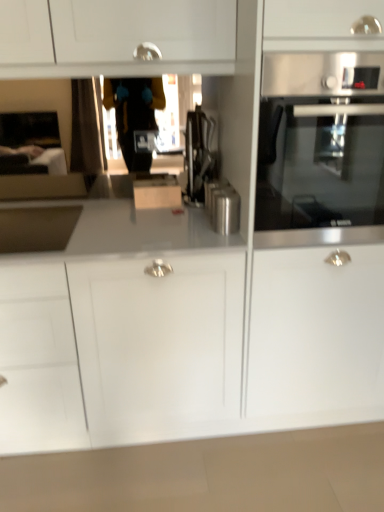
Question: From a real-world perspective, does satin nickel sink at left stand above satin metallic canister at center?

Choices:
 (A) yes
 (B) no

Answer: (B)

Question: Is satin nickel sink at left oriented away from satin metallic canister at center?

Choices:
 (A) no
 (B) yes

Answer: (A)

Question: From the image's perspective, does satin nickel sink at left appear higher than satin metallic canister at center?

Choices:
 (A) no
 (B) yes

Answer: (A)

Question: Is satin nickel sink at left shorter than satin metallic canister at center?

Choices:
 (A) yes
 (B) no

Answer: (A)

Question: Can you confirm if satin nickel sink at left is positioned to the left of satin metallic canister at center?

Choices:
 (A) yes
 (B) no

Answer: (A)

Question: In terms of width, does satin nickel sink at left look wider or thinner when compared to white glossy countertop at lower center?

Choices:
 (A) wide
 (B) thin

Answer: (B)

Question: Is satin nickel sink at left situated inside white glossy countertop at lower center or outside?

Choices:
 (A) inside
 (B) outside

Answer: (B)

Question: Is point (31, 211) positioned closer to the camera than point (269, 481)?

Choices:
 (A) closer
 (B) farther

Answer: (B)

Question: From a real-world perspective, relative to white glossy countertop at lower center, is satin nickel sink at left vertically above or below?

Choices:
 (A) below
 (B) above

Answer: (B)

Question: Is satin metallic canister at center in front of or behind stainless steel oven at right in the image?

Choices:
 (A) behind
 (B) front

Answer: (A)

Question: Visually, is satin metallic canister at center positioned to the left or to the right of stainless steel oven at right?

Choices:
 (A) right
 (B) left

Answer: (B)

Question: Is satin metallic canister at center wider or thinner than stainless steel oven at right?

Choices:
 (A) wide
 (B) thin

Answer: (B)

Question: Is satin metallic canister at center bigger or smaller than stainless steel oven at right?

Choices:
 (A) small
 (B) big

Answer: (A)

Question: Is satin black coffee machine at center inside the boundaries of satin nickel sink at left, or outside?

Choices:
 (A) inside
 (B) outside

Answer: (B)

Question: From the image's perspective, relative to satin nickel sink at left, is satin black coffee machine at center above or below?

Choices:
 (A) above
 (B) below

Answer: (A)